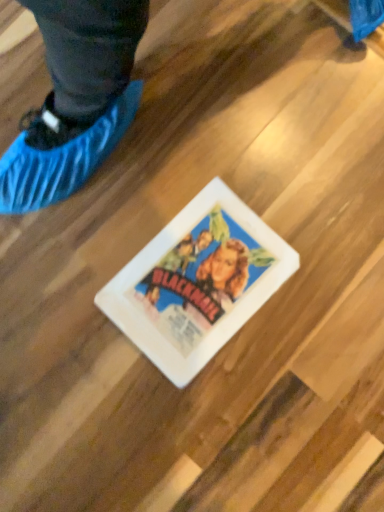
The width and height of the screenshot is (384, 512). What are the coordinates of `vacant area on the back side of white glossy book cover at center` in the screenshot? It's located at (200, 153).